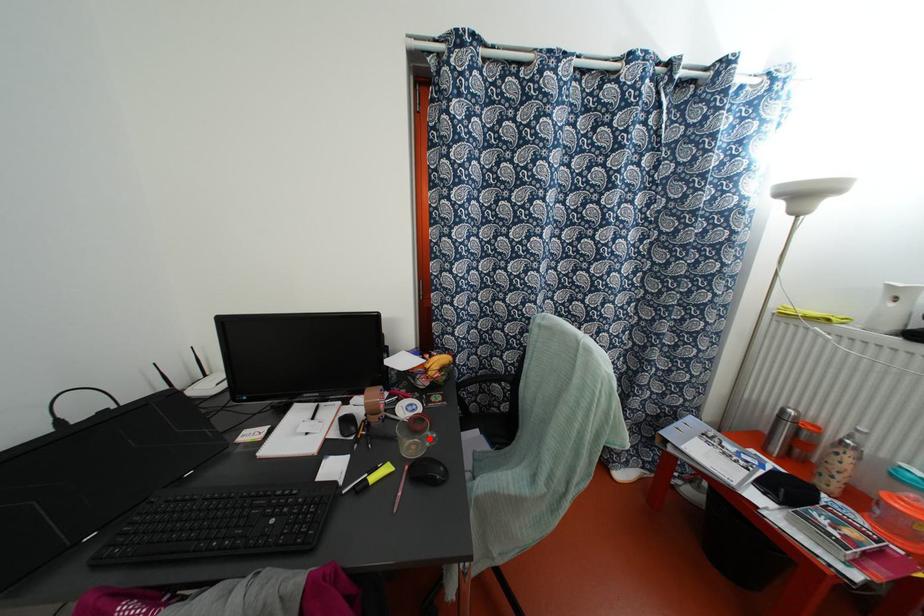
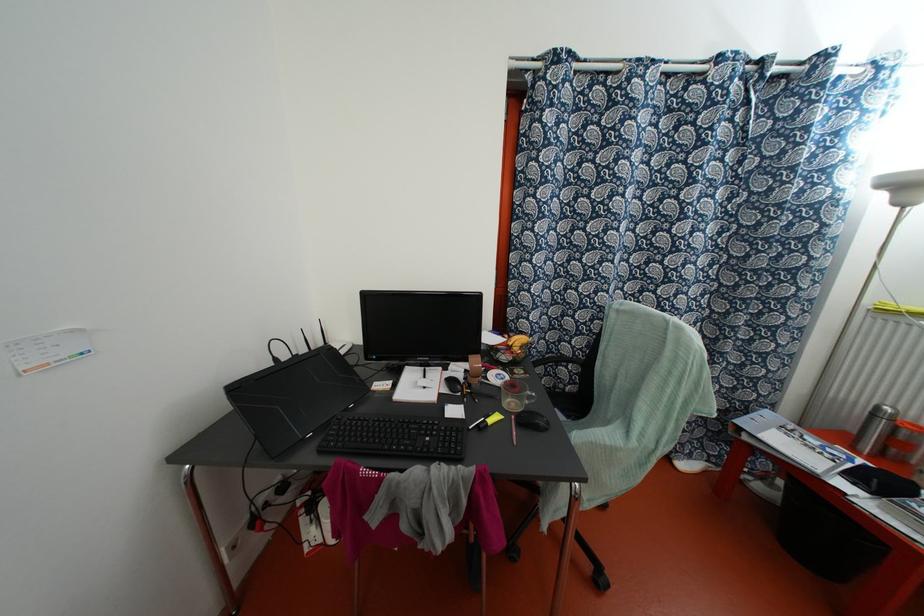
In the second image, find the point that corresponds to the highlighted location in the first image.

(529, 397)